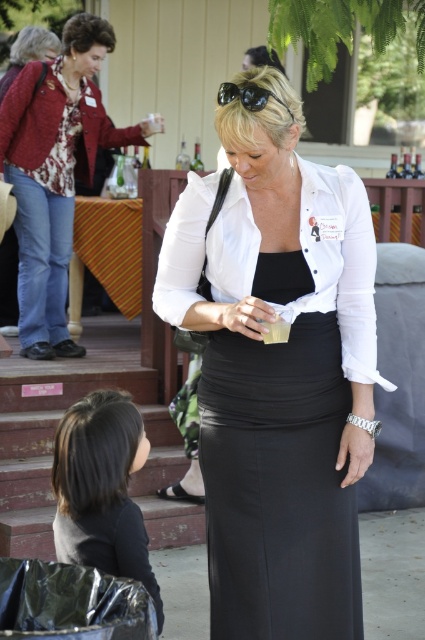
Is point (320, 166) farther from camera compared to point (346, 237)?

Yes, it is.

Is matte white blouse at center taller than white matte shirt at center?

Correct, matte white blouse at center is much taller as white matte shirt at center.

The height and width of the screenshot is (640, 425). What do you see at coordinates (278, 372) in the screenshot?
I see `matte white blouse at center` at bounding box center [278, 372].

The height and width of the screenshot is (640, 425). I want to click on matte white blouse at center, so click(278, 372).

Image resolution: width=425 pixels, height=640 pixels. Describe the element at coordinates (56, 172) in the screenshot. I see `matte red jacket at upper left` at that location.

Locate an element on the screen. The image size is (425, 640). matte red jacket at upper left is located at coordinates (56, 172).

Is point (45, 184) less distant than point (227, 97)?

No, it is not.

Find the location of a particular element. The height and width of the screenshot is (640, 425). matte red jacket at upper left is located at coordinates (56, 172).

Can you confirm if matte white blouse at center is positioned below black fabric hair at lower left?

No.

Is point (206, 301) farther from viewer compared to point (139, 465)?

No, it is in front of (139, 465).

Identify the location of matte white blouse at center. (278, 372).